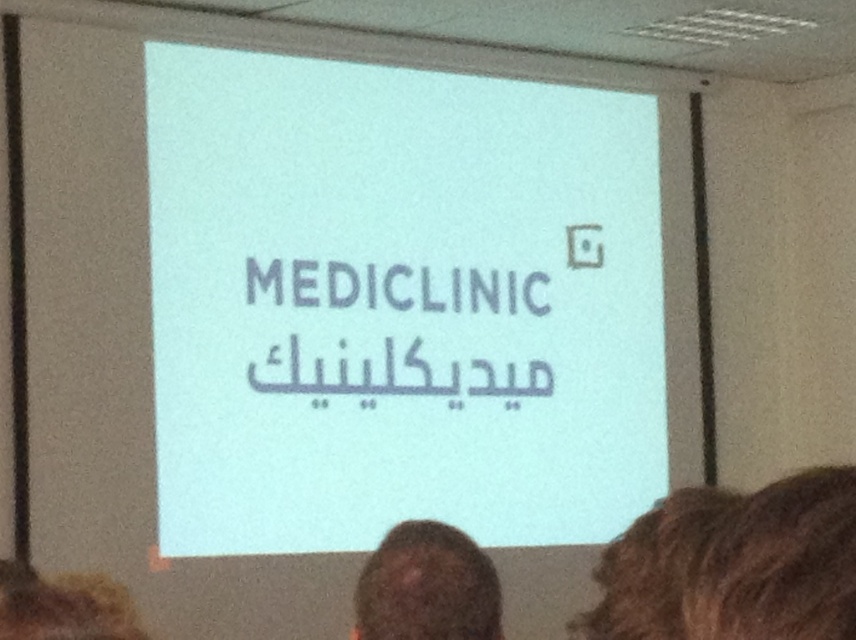
Looking at this image, you are an attendee at a conference and you see the white matte projection screen at center and the brown curly hair at lower right. Which object is taller?

The white matte projection screen at center is taller than the brown curly hair at lower right.

You are a presenter standing at the front of the room. You need to walk to the white matte projection screen at center to adjust it, but you must avoid stepping on the brown curly hair at lower right. Can you safely reach the screen without getting too close to the hair?

The distance between the white matte projection screen at center and the brown curly hair at lower right is 14.09 feet, so yes, you can safely walk to the screen while maintaining a safe distance from the hair.

You are an attendee at the presentation. You notice the white matte projection screen at center and the blonde hair at lower left. Which object is bigger in size?

The white matte projection screen at center has a larger size compared to blonde hair at lower left.